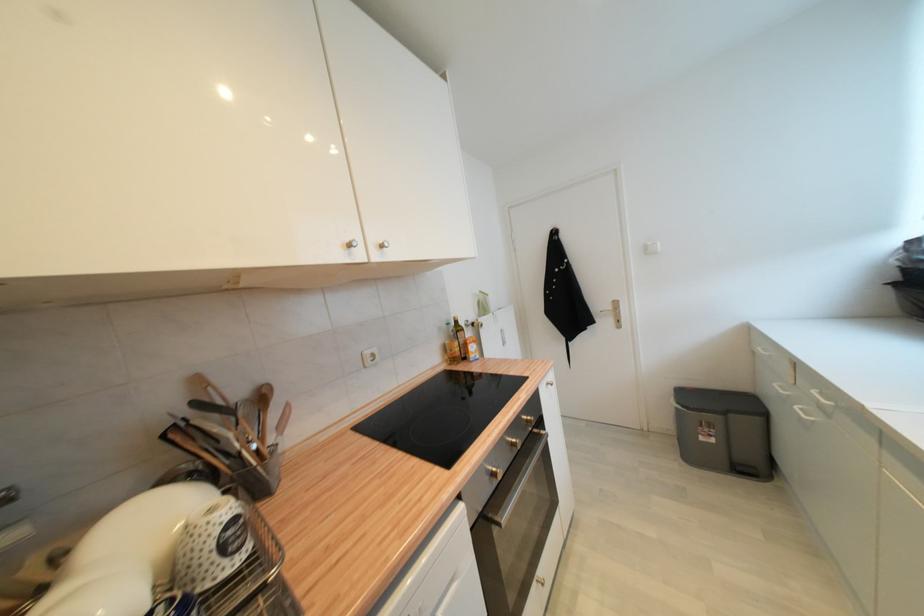
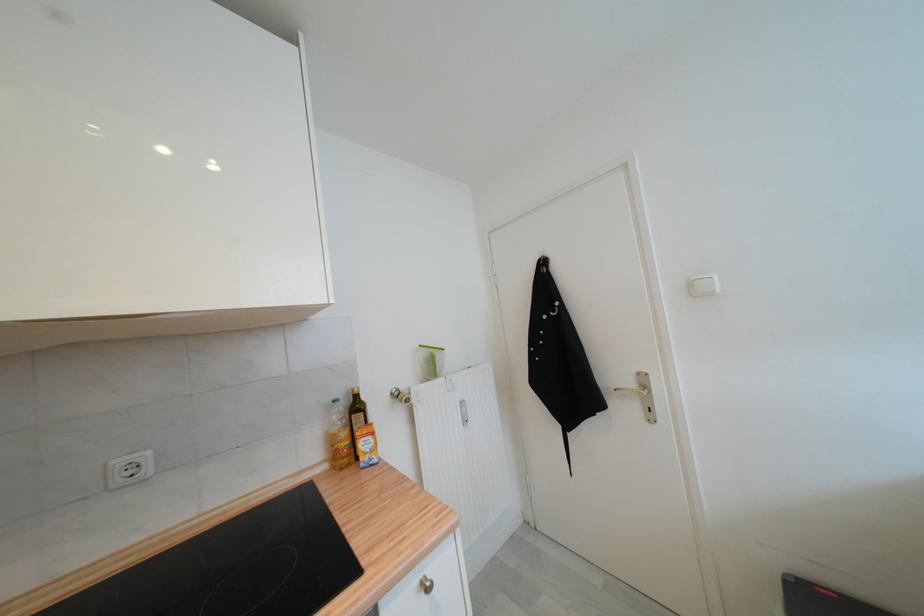
In the second image, find the point that corresponds to pixel 372 354 in the first image.

(126, 464)